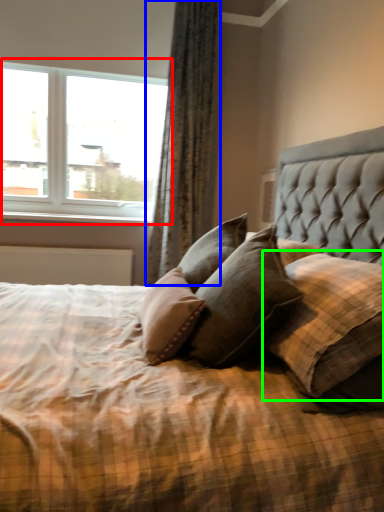
Question: Estimate the real-world distances between objects in this image. Which object is closer to window (highlighted by a red box), curtain (highlighted by a blue box) or pillow (highlighted by a green box)?

Choices:
 (A) curtain
 (B) pillow

Answer: (A)